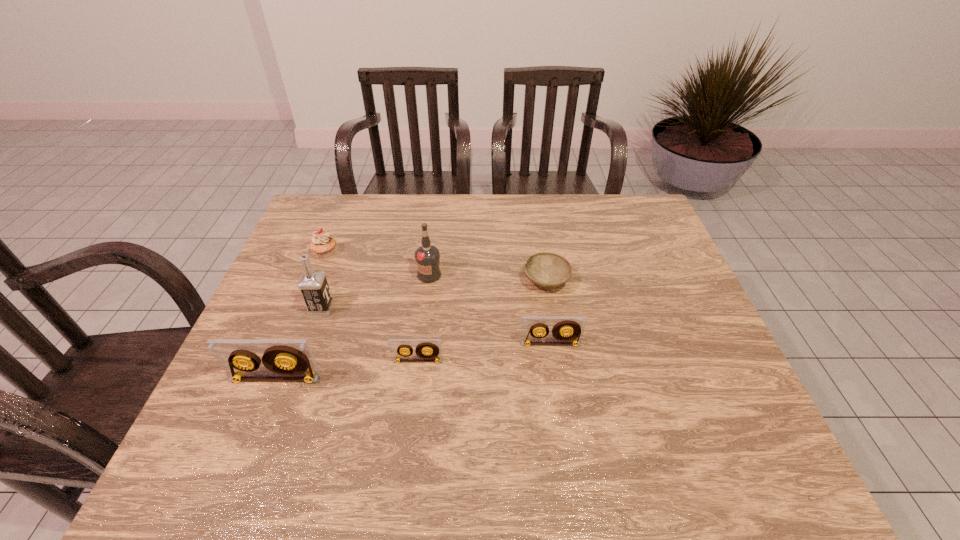
Where is `the shortest object`? the shortest object is located at coordinates (548, 270).

Image resolution: width=960 pixels, height=540 pixels. In order to click on vacant space located 0.140m at the front of the shortest videotape with visible reels in this screenshot , I will do `click(411, 417)`.

The height and width of the screenshot is (540, 960). In order to click on vacant area situated at the front of the farthest videotape with visible reels in this screenshot , I will do `click(558, 393)`.

Where is `vacant space located on the right of the cupcake`? The width and height of the screenshot is (960, 540). vacant space located on the right of the cupcake is located at coordinates (417, 253).

You are a GUI agent. You are given a task and a screenshot of the screen. Output one action in this format:
    pyautogui.click(x=<x>, y=<y>)
    Task: Click on the vacant space located on the front label of the right vodka
    The width and height of the screenshot is (960, 540).
    Given the screenshot: What is the action you would take?
    pyautogui.click(x=417, y=379)

This screenshot has width=960, height=540. Identify the location of blank area located on the front label of the nearer vodka. (370, 308).

The width and height of the screenshot is (960, 540). Identify the location of vacant space situated on the left of the bowl. (474, 280).

Locate an element on the screen. The height and width of the screenshot is (540, 960). videotape that is at the left edge is located at coordinates pos(283,359).

At what (x,y) coordinates should I click in order to perform the action: click on cupcake that is at the left edge. Please return your answer as a coordinate pair (x, y). Image resolution: width=960 pixels, height=540 pixels. Looking at the image, I should click on (322, 244).

Locate an element on the screen. vodka positioned at the left edge is located at coordinates (313, 285).